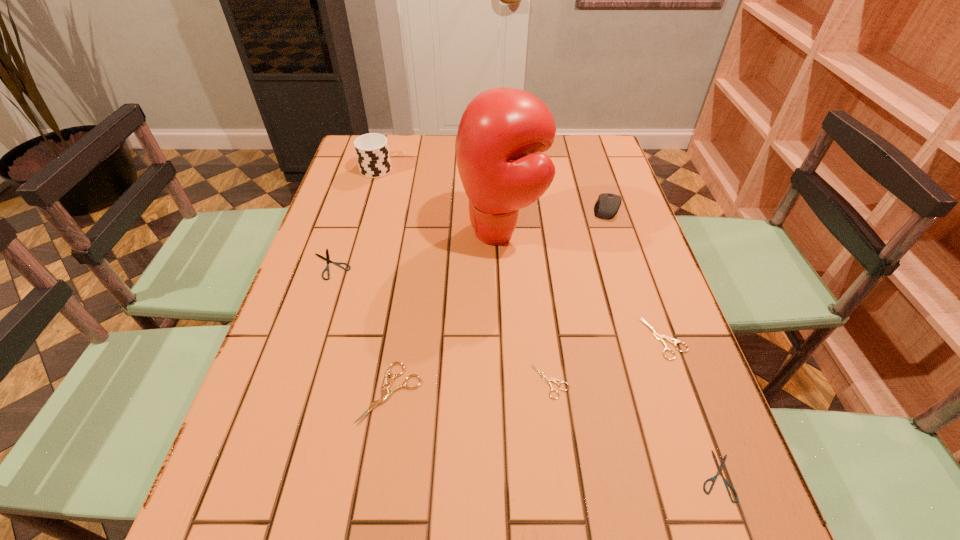
Find the location of `free point between the second beige shears from right to left and the nearer black shears`. free point between the second beige shears from right to left and the nearer black shears is located at coordinates (634, 428).

Locate an element on the screen. free spot between the black computer equipment and the farthest shears is located at coordinates (469, 236).

The height and width of the screenshot is (540, 960). I want to click on free space that is in between the farthest shears and the biggest beige shears, so click(361, 328).

This screenshot has height=540, width=960. I want to click on empty location between the sixth object from right to left and the second biggest beige shears, so click(x=527, y=366).

Locate an element on the screen. The width and height of the screenshot is (960, 540). vacant area that lies between the right black shears and the left black shears is located at coordinates (524, 370).

Identify the location of unoccupied area between the farthest object and the fourth shortest shears. (520, 253).

Locate an element on the screen. The width and height of the screenshot is (960, 540). vacant area that lies between the sixth shortest object and the tallest object is located at coordinates 554,220.

The image size is (960, 540). In order to click on the closest object relative to the left black shears in this screenshot , I will do `click(386, 394)`.

The width and height of the screenshot is (960, 540). In order to click on object that is the third nearest to the tallest object in this screenshot , I will do `click(372, 151)`.

Identify the location of shears that is the closest one to the computer equipment. The image size is (960, 540). (661, 338).